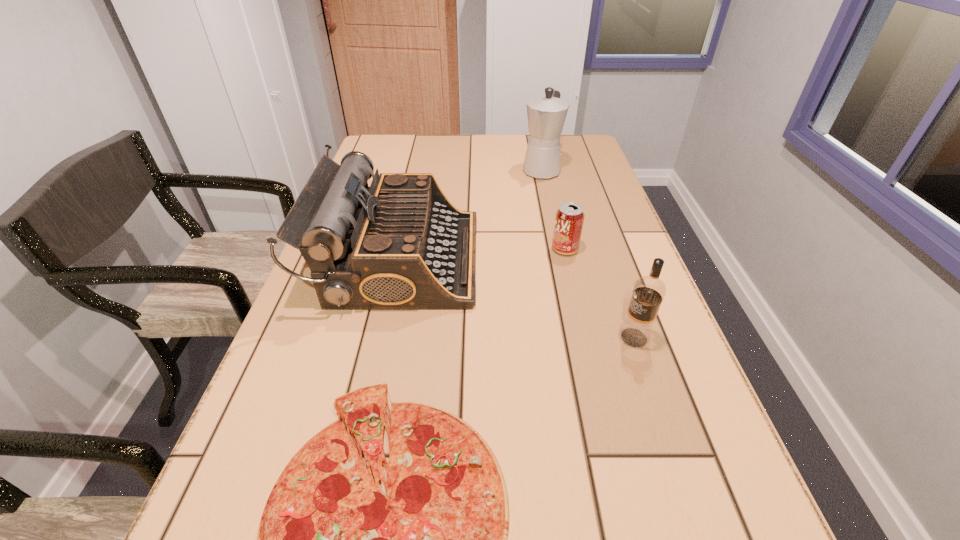
The height and width of the screenshot is (540, 960). Identify the location of free space at the far right corner of the desktop. (591, 153).

At what (x,y) coordinates should I click in order to perform the action: click on free space that is in between the rightmost object and the farthest object. Please return your answer as a coordinate pair (x, y). The height and width of the screenshot is (540, 960). Looking at the image, I should click on (588, 254).

Find the location of a particular element. This screenshot has width=960, height=540. unoccupied position between the soda can and the fourth farthest object is located at coordinates (599, 293).

Where is `free space between the farthest object and the fourth tallest object`? Image resolution: width=960 pixels, height=540 pixels. free space between the farthest object and the fourth tallest object is located at coordinates (553, 210).

Locate an element on the screen. empty space between the typewriter and the rightmost object is located at coordinates (516, 298).

I want to click on free point between the coffeepot and the rightmost object, so point(588,254).

The height and width of the screenshot is (540, 960). What are the coordinates of `vacant region between the rightmost object and the typewriter` in the screenshot? It's located at (516, 298).

Identify which object is located as the second nearest to the soda can. Please provide its 2D coordinates. Your answer should be formatted as a tuple, i.e. [(x, y)], where the tuple contains the x and y coordinates of a point satisfying the conditions above.

[(649, 291)]

At what (x,y) coordinates should I click in order to perform the action: click on object that is the fourth closest to the pizza. Please return your answer as a coordinate pair (x, y). The width and height of the screenshot is (960, 540). Looking at the image, I should click on (546, 115).

This screenshot has width=960, height=540. In order to click on vacant space that satisfies the following two spatial constraints: 1. on the front side of the tallest object; 2. on the right side of the soda can in this screenshot , I will do `click(559, 249)`.